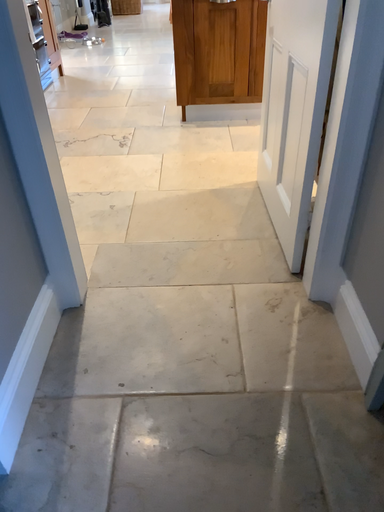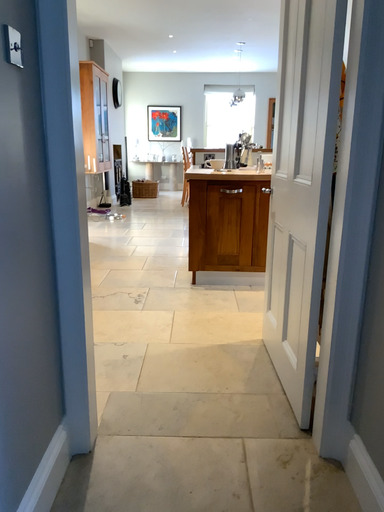
Question: How did the camera likely rotate when shooting the video?

Choices:
 (A) rotated downward
 (B) rotated upward

Answer: (B)